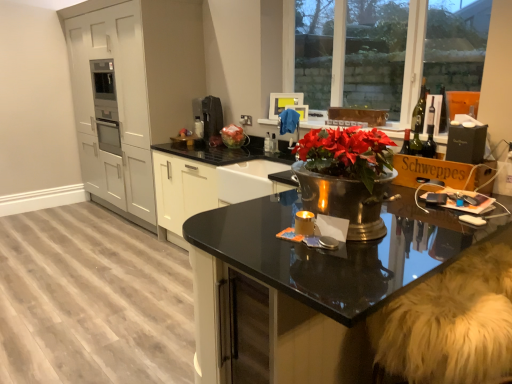
Question: From a real-world perspective, is wooden cardboard box at right physically below white fur swivel chair at lower right?

Choices:
 (A) yes
 (B) no

Answer: (B)

Question: Does wooden cardboard box at right appear on the left side of white fur swivel chair at lower right?

Choices:
 (A) no
 (B) yes

Answer: (A)

Question: Is wooden cardboard box at right looking in the opposite direction of white fur swivel chair at lower right?

Choices:
 (A) yes
 (B) no

Answer: (B)

Question: Considering the relative sizes of wooden cardboard box at right and white fur swivel chair at lower right in the image provided, is wooden cardboard box at right shorter than white fur swivel chair at lower right?

Choices:
 (A) yes
 (B) no

Answer: (A)

Question: Is wooden cardboard box at right thinner than white fur swivel chair at lower right?

Choices:
 (A) no
 (B) yes

Answer: (B)

Question: In the image, is metallic sink at center on the left side or the right side of matte white cabinets at left?

Choices:
 (A) right
 (B) left

Answer: (A)

Question: In terms of size, does metallic sink at center appear bigger or smaller than matte white cabinets at left?

Choices:
 (A) big
 (B) small

Answer: (B)

Question: From a real-world perspective, is metallic sink at center above or below matte white cabinets at left?

Choices:
 (A) below
 (B) above

Answer: (A)

Question: From the image's perspective, is metallic sink at center above or below matte white cabinets at left?

Choices:
 (A) above
 (B) below

Answer: (B)

Question: Relative to clear glass window at upper right, is wooden cardboard box at right in front or behind?

Choices:
 (A) behind
 (B) front

Answer: (B)

Question: Is point (485, 180) closer or farther from the camera than point (433, 66)?

Choices:
 (A) closer
 (B) farther

Answer: (A)

Question: Would you say wooden cardboard box at right is to the left or to the right of clear glass window at upper right in the picture?

Choices:
 (A) left
 (B) right

Answer: (B)

Question: From their relative heights in the image, would you say wooden cardboard box at right is taller or shorter than clear glass window at upper right?

Choices:
 (A) short
 (B) tall

Answer: (A)

Question: Is green glass wine bottle at upper right taller or shorter than clear glass window at upper right?

Choices:
 (A) tall
 (B) short

Answer: (B)

Question: From a real-world perspective, relative to clear glass window at upper right, is green glass wine bottle at upper right vertically above or below?

Choices:
 (A) above
 (B) below

Answer: (B)